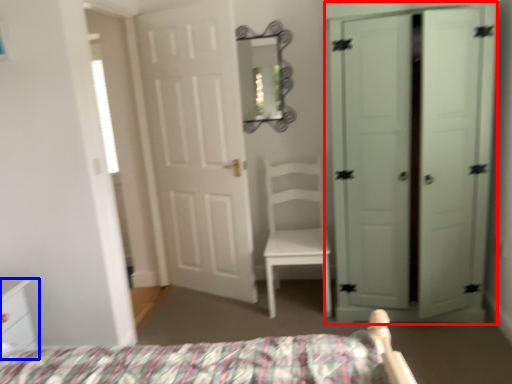
Question: Among these objects, which one is nearest to the camera, door (highlighted by a red box) or nightstand (highlighted by a blue box)?

Choices:
 (A) door
 (B) nightstand

Answer: (B)